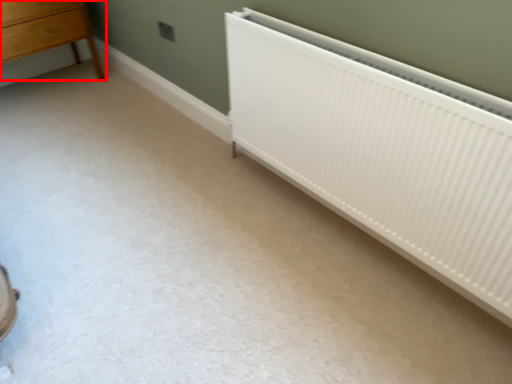
Question: From the image's perspective, considering the relative positions of chest of drawers (annotated by the red box) and radiator in the image provided, where is chest of drawers (annotated by the red box) located with respect to the staircase?

Choices:
 (A) below
 (B) above

Answer: (B)